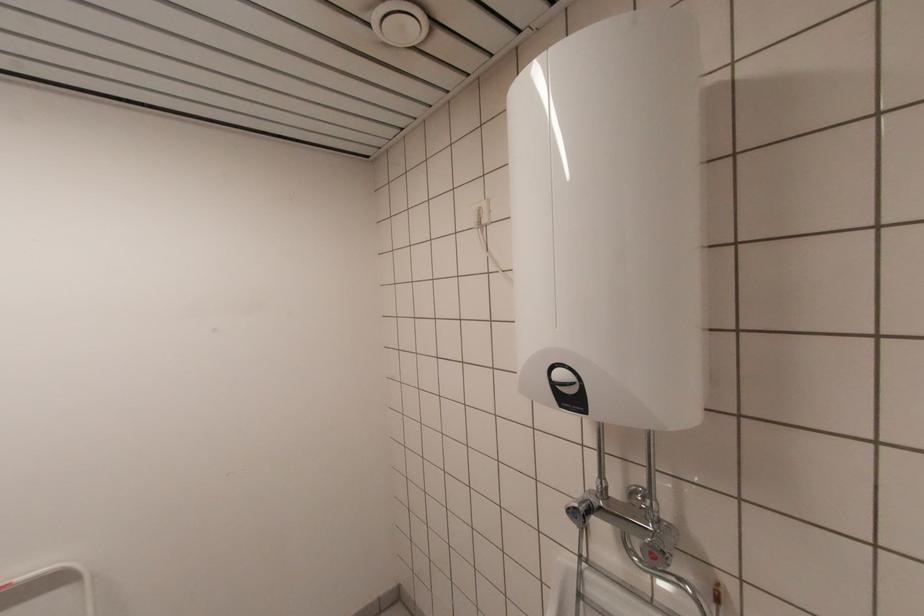
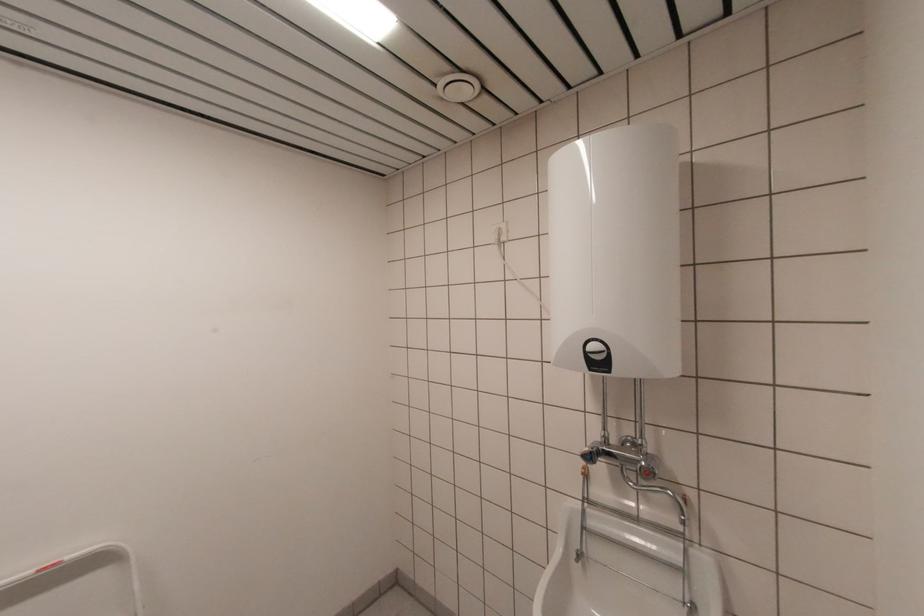
In the second image, find the point that corresponds to (x=481, y=223) in the first image.

(501, 240)